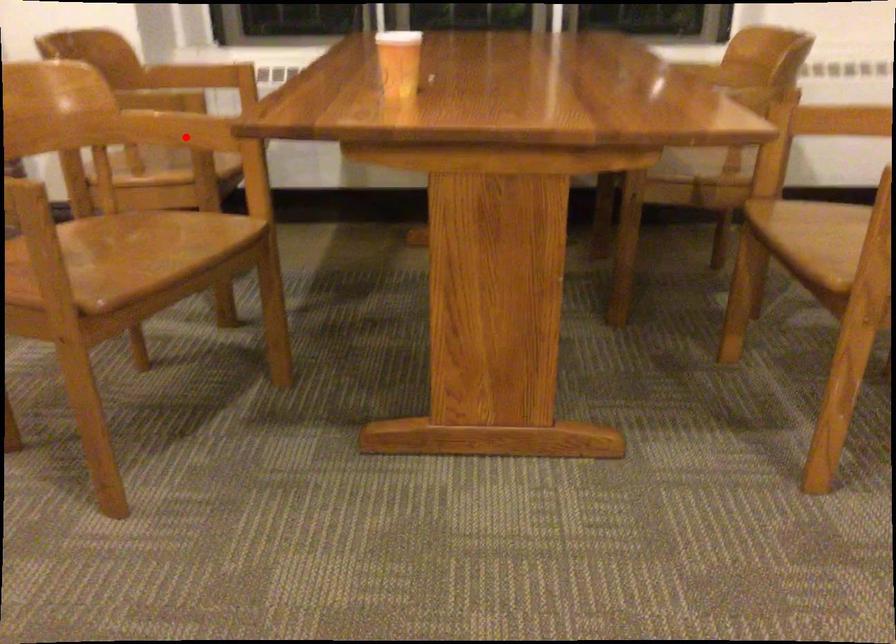
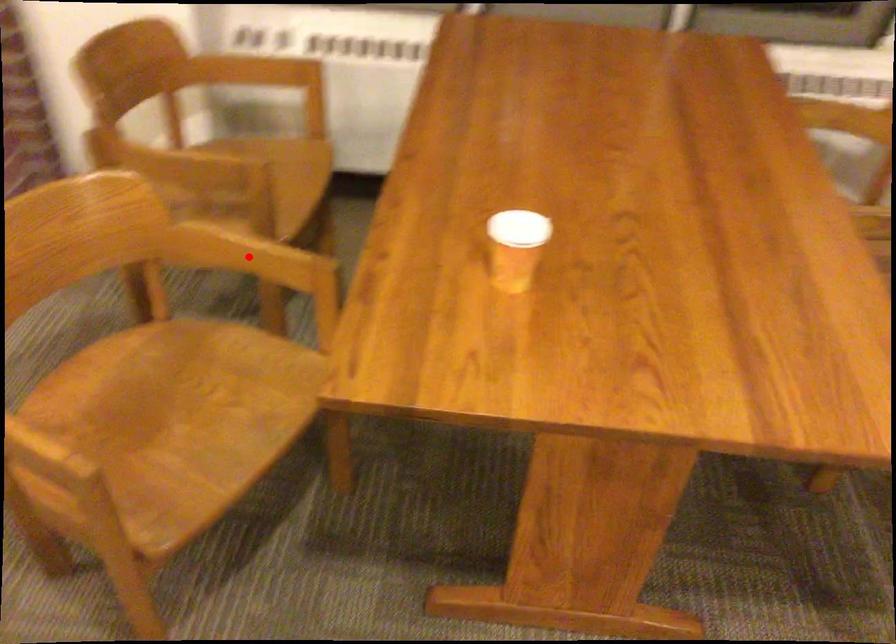
I am providing you with two images of the same scene from different viewpoints. A red point is marked on the first image and another point is marked on the second image. Is the marked point in image1 the same physical position as the marked point in image2?

Yes